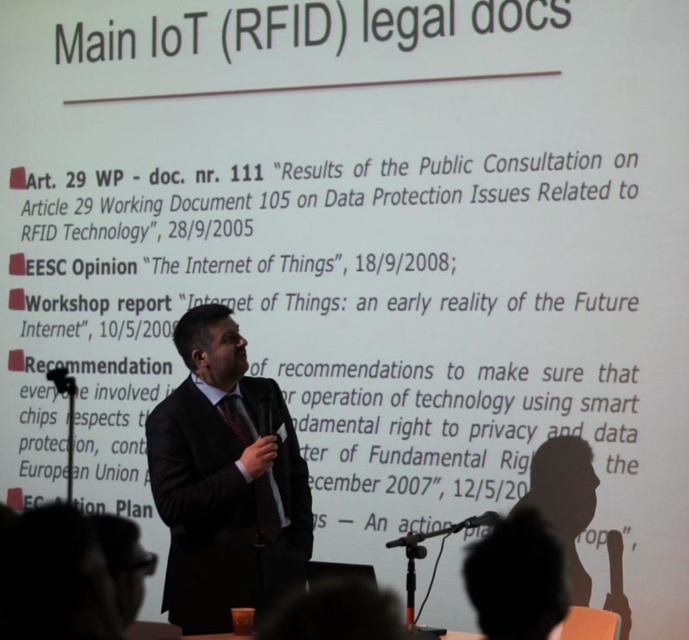
Question: Which point is closer to the camera?

Choices:
 (A) black plastic microphone at lower center
 (B) black suit at center

Answer: (B)

Question: Does black suit at center have a larger size compared to black plastic microphone at lower center?

Choices:
 (A) yes
 (B) no

Answer: (A)

Question: Can you confirm if black suit at center is positioned below black plastic microphone at lower center?

Choices:
 (A) no
 (B) yes

Answer: (A)

Question: Which point appears farthest from the camera in this image?

Choices:
 (A) (491, 513)
 (B) (176, 394)

Answer: (A)

Question: Which of the following is the farthest from the observer?

Choices:
 (A) (174, 460)
 (B) (453, 529)

Answer: (B)

Question: From the image, what is the correct spatial relationship of black suit at center in relation to black plastic microphone at lower center?

Choices:
 (A) right
 (B) left

Answer: (B)